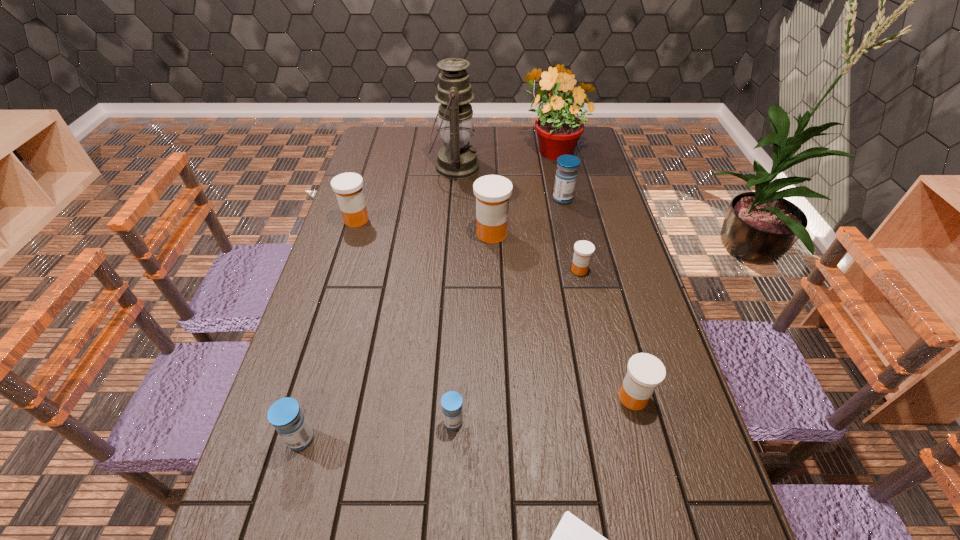
Locate an element on the screen. This screenshot has width=960, height=540. free space at the left edge of the desktop is located at coordinates pyautogui.click(x=328, y=352).

Find the location of a particular element. This screenshot has height=540, width=960. vacant region at the right edge is located at coordinates (636, 327).

I want to click on vacant space that's between the second orange medicine from left to right and the leftmost orange medicine, so click(424, 227).

At what (x,y) coordinates should I click in order to perform the action: click on free space between the oil lamp and the fourth farthest medicine. Please return your answer as a coordinate pair (x, y). Image resolution: width=960 pixels, height=540 pixels. Looking at the image, I should click on (517, 219).

Image resolution: width=960 pixels, height=540 pixels. Identify the location of free space that is in between the nearest orange medicine and the smallest orange medicine. (606, 334).

Find the location of `free spot between the nearest orange medicine and the fifth medicine from right to left`. free spot between the nearest orange medicine and the fifth medicine from right to left is located at coordinates (543, 409).

The image size is (960, 540). What are the coordinates of `free point between the oil lamp and the third medicine from left to right` in the screenshot? It's located at (454, 294).

The height and width of the screenshot is (540, 960). I want to click on vacant space that is in between the leftmost blue medicine and the rightmost blue medicine, so click(432, 319).

Find the location of `free spot between the third farthest object and the third smallest orange medicine`. free spot between the third farthest object and the third smallest orange medicine is located at coordinates (460, 210).

Identify the location of vacant space in between the third medicine from left to right and the red flowerpot. This screenshot has width=960, height=540. (503, 285).